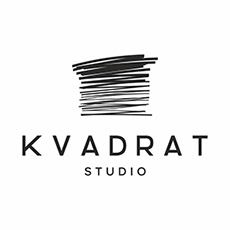
I want to click on studio, so pos(111,171).